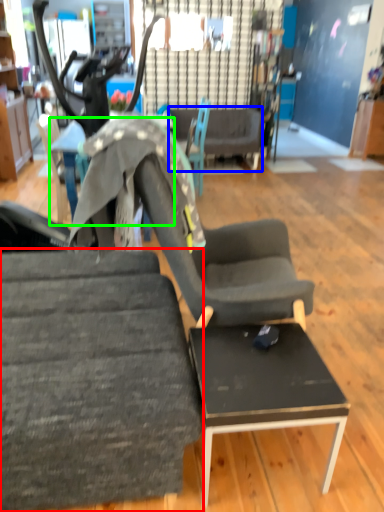
Question: Based on their relative distances, which object is nearer to chair (highlighted by a red box)? Choose from couch (highlighted by a blue box) and table (highlighted by a green box).

Choices:
 (A) couch
 (B) table

Answer: (B)